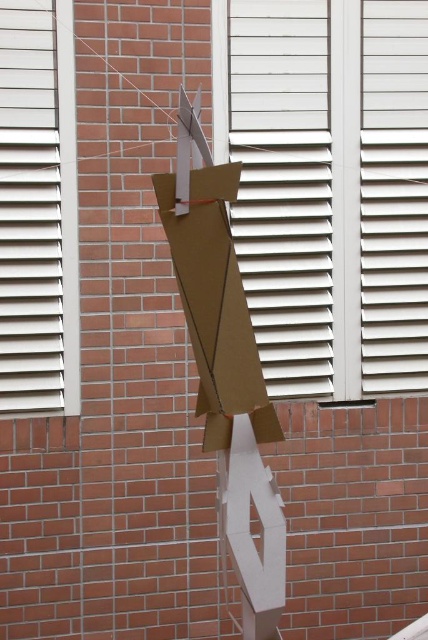
You are an observer looking at the wall. There is a white textured window at center and a brown cardboard at center. Which object is closer to you?

The white textured window at center is closer to you because the brown cardboard at center is behind it.

You are standing in front of a wall with a white matte window at center. If you want to take a photo of the window without any obstructions, how far back should you be to ensure the entire window fits in your camera frame?

You should stand at least 13.93 feet away from the white matte window at center to ensure it fits entirely within your camera frame without obstructions.